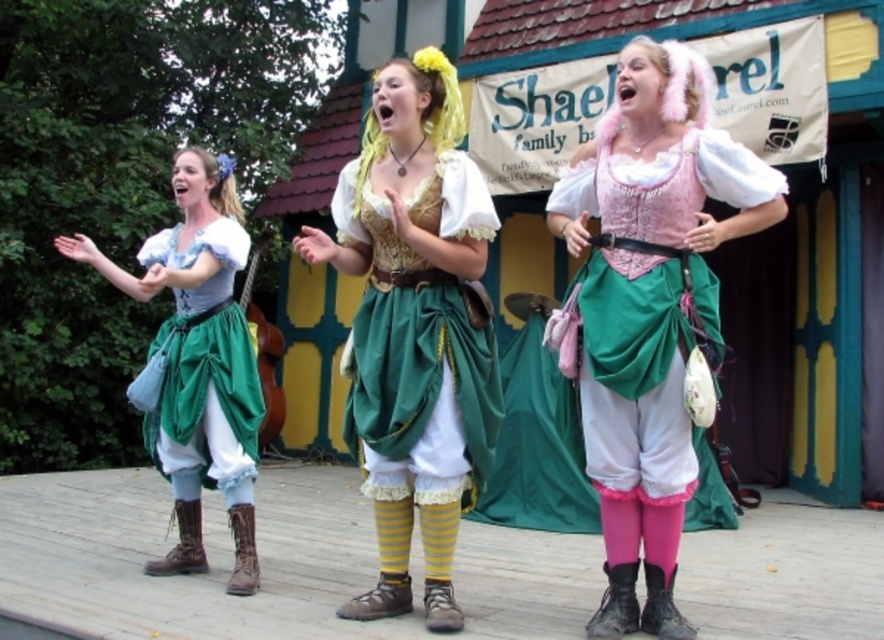
Question: Which point is farther to the camera?

Choices:
 (A) (239, 525)
 (B) (671, 104)

Answer: (A)

Question: Which object appears farthest from the camera in this image?

Choices:
 (A) green satin dress at center
 (B) yellowhair/fabricwig at center
 (C) matte green skirt at center

Answer: (C)

Question: Which is farther from the blonde hair at left?

Choices:
 (A) matte blue fabric dress at left
 (B) brown leather boot at lower center
 (C) green satin dress at center

Answer: (B)

Question: Can you confirm if brown leather boot at lower center is smaller than pink fluffy wig at center?

Choices:
 (A) yes
 (B) no

Answer: (B)

Question: Can you confirm if matte green skirt at center is thinner than blonde hair at left?

Choices:
 (A) yes
 (B) no

Answer: (B)

Question: Is matte green skirt at center bigger than brown leather boot at lower center?

Choices:
 (A) no
 (B) yes

Answer: (B)